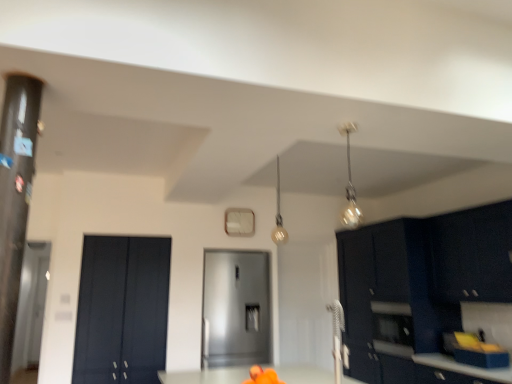
Question: Can you confirm if transparent glass door at left is positioned to the right of matte gold light fixture at upper center, placed as the 2th light fixture when sorted from front to back?

Choices:
 (A) no
 (B) yes

Answer: (A)

Question: From the image's perspective, is transparent glass door at left above matte gold light fixture at upper center, which ranks as the 1th light fixture in back-to-front order?

Choices:
 (A) no
 (B) yes

Answer: (A)

Question: Is transparent glass door at left aimed at matte gold light fixture at upper center, marked as the 2th light fixture in a right-to-left arrangement?

Choices:
 (A) no
 (B) yes

Answer: (A)

Question: Can you confirm if transparent glass door at left is shorter than matte gold light fixture at upper center, placed as the 2th light fixture when sorted from front to back?

Choices:
 (A) yes
 (B) no

Answer: (B)

Question: Is transparent glass door at left turned away from matte gold light fixture at upper center, placed as the 2th light fixture when sorted from front to back?

Choices:
 (A) no
 (B) yes

Answer: (A)

Question: Choose the correct answer: Is metallic glass pendant light at upper right, the second light fixture in the back-to-front sequence, inside matte gold light fixture at upper center, which ranks as the 1th light fixture in back-to-front order, or outside it?

Choices:
 (A) outside
 (B) inside

Answer: (A)

Question: Considering their positions, is metallic glass pendant light at upper right, acting as the first light fixture starting from the right, located in front of or behind matte gold light fixture at upper center, placed as the 2th light fixture when sorted from front to back?

Choices:
 (A) behind
 (B) front

Answer: (B)

Question: From the image's perspective, relative to matte gold light fixture at upper center, marked as the first light fixture in a left-to-right arrangement, is metallic glass pendant light at upper right, marked as the 1th light fixture in a front-to-back arrangement, above or below?

Choices:
 (A) above
 (B) below

Answer: (A)

Question: Considering the relative positions of metallic glass pendant light at upper right, acting as the first light fixture starting from the right, and matte gold light fixture at upper center, which ranks as the 1th light fixture in back-to-front order, in the image provided, is metallic glass pendant light at upper right, acting as the first light fixture starting from the right, to the left or to the right of matte gold light fixture at upper center, which ranks as the 1th light fixture in back-to-front order,?

Choices:
 (A) left
 (B) right

Answer: (B)

Question: Looking at their shapes, would you say matte black cabinet at left, acting as the second door starting from the right, is wider or thinner than matte black cabinets at right, arranged as the 1th cabinetry when viewed from the back?

Choices:
 (A) wide
 (B) thin

Answer: (B)

Question: In the image, is matte black cabinet at left, the 1th door when ordered from left to right, on the left side or the right side of matte black cabinets at right, which ranks as the 2th cabinetry in front-to-back order?

Choices:
 (A) right
 (B) left

Answer: (B)

Question: Considering their positions, is matte black cabinet at left, the 1th door when ordered from left to right, located in front of or behind matte black cabinets at right, arranged as the 1th cabinetry when viewed from the back?

Choices:
 (A) behind
 (B) front

Answer: (A)

Question: In terms of height, does matte black cabinet at left, the 1th door when ordered from left to right, look taller or shorter compared to matte black cabinets at right, arranged as the 1th cabinetry when viewed from the back?

Choices:
 (A) short
 (B) tall

Answer: (A)

Question: In terms of height, does metallic glass pendant light at upper right, the second light fixture in the back-to-front sequence, look taller or shorter compared to matte black cabinets at right, which ranks as the 2th cabinetry in front-to-back order?

Choices:
 (A) short
 (B) tall

Answer: (A)

Question: Is metallic glass pendant light at upper right, the second light fixture in the back-to-front sequence, to the left or to the right of matte black cabinets at right, which ranks as the 2th cabinetry in front-to-back order, in the image?

Choices:
 (A) right
 (B) left

Answer: (B)